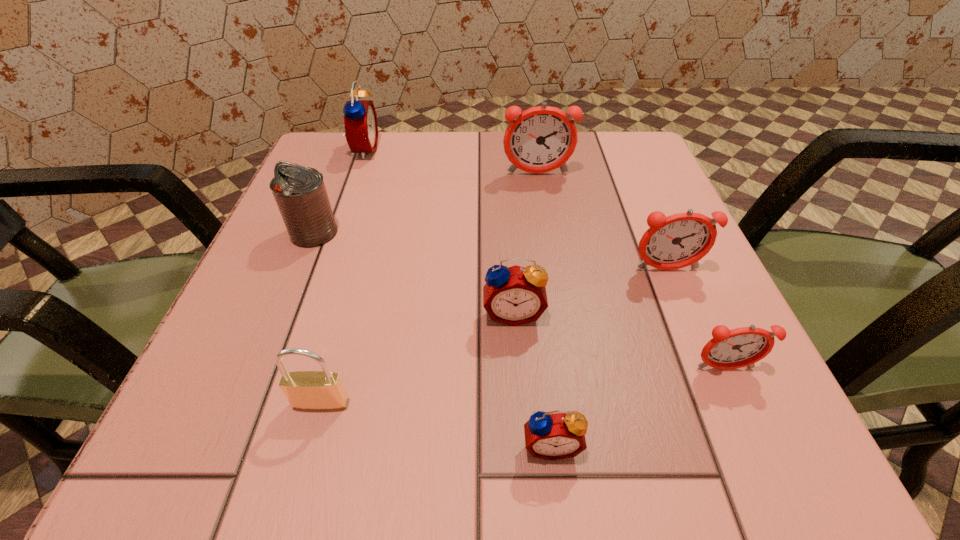
Find the location of a particular element. The height and width of the screenshot is (540, 960). the second nearest object is located at coordinates (323, 390).

I want to click on the sixth farthest object, so click(x=728, y=349).

Image resolution: width=960 pixels, height=540 pixels. Identify the location of the second nearest alarm clock. (728, 349).

Image resolution: width=960 pixels, height=540 pixels. I want to click on the nearest object, so click(555, 435).

Locate an element on the screen. This screenshot has width=960, height=540. the nearest red alarm clock is located at coordinates (x=555, y=435).

Locate an element on the screen. The height and width of the screenshot is (540, 960). free space located 0.050m on the front-facing side of the leftmost alarm clock is located at coordinates (400, 150).

Image resolution: width=960 pixels, height=540 pixels. Find the location of `free space located on the front-facing side of the leftmost reddish-pink alarm clock`. free space located on the front-facing side of the leftmost reddish-pink alarm clock is located at coordinates (556, 287).

Locate an element on the screen. This screenshot has height=540, width=960. free point located 0.140m on the right of the can is located at coordinates (417, 232).

You are a GUI agent. You are given a task and a screenshot of the screen. Output one action in this format:
    pyautogui.click(x=<x>, y=<y>)
    Task: Click on the vacant point located 0.060m on the front-facing side of the third farthest alarm clock
    
    Given the screenshot: What is the action you would take?
    pyautogui.click(x=681, y=304)

Where is `vacant area situated 0.080m on the front-facing side of the third nearest alarm clock`? vacant area situated 0.080m on the front-facing side of the third nearest alarm clock is located at coordinates (517, 376).